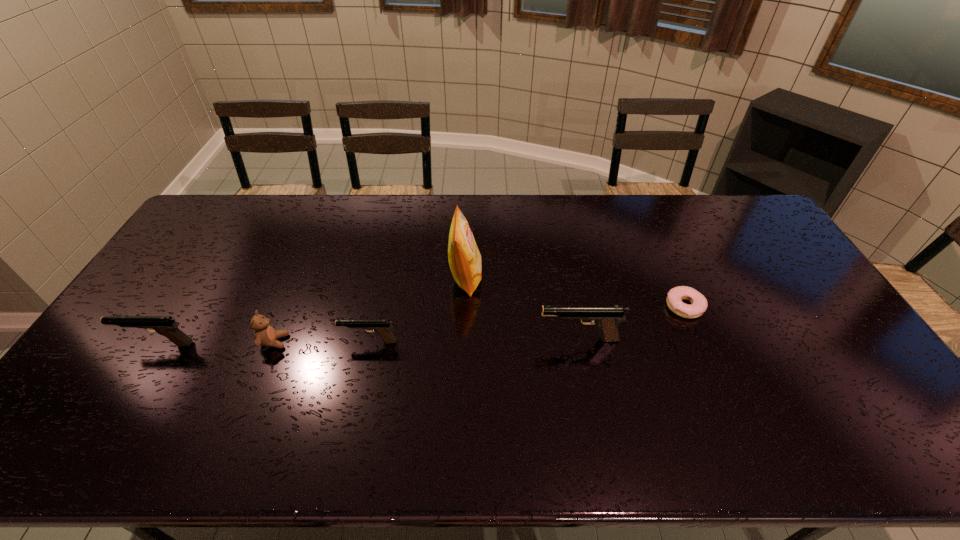
This screenshot has width=960, height=540. I want to click on free region located 0.260m on the right of the rightmost object, so click(791, 307).

I want to click on object located at the left edge, so click(x=164, y=325).

Identify the location of free space at the far edge of the desktop. The width and height of the screenshot is (960, 540). (601, 209).

Locate an element on the screen. The height and width of the screenshot is (540, 960). free space at the left edge of the desktop is located at coordinates (213, 248).

Find the location of `vacant region at the right edge of the desktop`. vacant region at the right edge of the desktop is located at coordinates (782, 281).

In the image, there is a desktop. At what (x,y) coordinates should I click in order to perform the action: click on free space at the far left corner. Please return your answer as a coordinate pair (x, y). The height and width of the screenshot is (540, 960). Looking at the image, I should click on (206, 222).

Where is `free space at the far right corner of the desktop`? Image resolution: width=960 pixels, height=540 pixels. free space at the far right corner of the desktop is located at coordinates (741, 231).

The width and height of the screenshot is (960, 540). Identify the location of vacant space that is in between the fourth object from right to left and the doughnut. (527, 324).

Locate an element on the screen. The width and height of the screenshot is (960, 540). vacant space in between the fourth object from right to left and the shortest object is located at coordinates (527, 324).

Identify the location of blank region between the rightmost object and the second object from left to right. Image resolution: width=960 pixels, height=540 pixels. (479, 324).